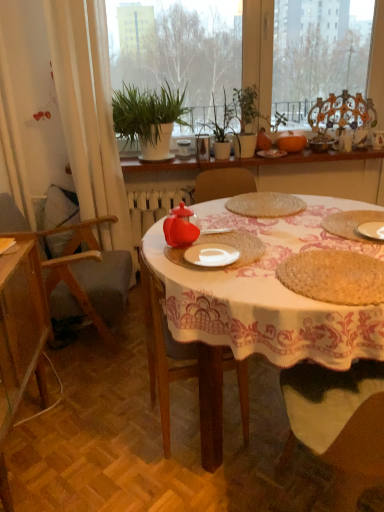
Question: Is the position of transparent glass chair at upper right, the 1th chair positioned from the right, more distant than that of green matte plant at center?

Choices:
 (A) no
 (B) yes

Answer: (B)

Question: Considering the relative sizes of transparent glass chair at upper right, which is the 3th chair from front to back, and green matte plant at center in the image provided, is transparent glass chair at upper right, which is the 3th chair from front to back, thinner than green matte plant at center?

Choices:
 (A) yes
 (B) no

Answer: (A)

Question: Can you confirm if transparent glass chair at upper right, the first chair in the back-to-front sequence, is taller than green matte plant at center?

Choices:
 (A) yes
 (B) no

Answer: (B)

Question: Is transparent glass chair at upper right, which is the 3th chair from front to back, touching green matte plant at center?

Choices:
 (A) yes
 (B) no

Answer: (B)

Question: Can you confirm if transparent glass chair at upper right, the first chair in the back-to-front sequence, is smaller than green matte plant at center?

Choices:
 (A) yes
 (B) no

Answer: (A)

Question: In the image, is wooden chair at left, which ranks as the second chair in top-to-bottom order, positioned in front of or behind orange matte pumpkin at center?

Choices:
 (A) front
 (B) behind

Answer: (A)

Question: From their relative heights in the image, would you say wooden chair at left, which ranks as the second chair in top-to-bottom order, is taller or shorter than orange matte pumpkin at center?

Choices:
 (A) tall
 (B) short

Answer: (A)

Question: Considering the positions of wooden chair at left, which is the first chair from left to right, and orange matte pumpkin at center in the image, is wooden chair at left, which is the first chair from left to right, bigger or smaller than orange matte pumpkin at center?

Choices:
 (A) big
 (B) small

Answer: (A)

Question: From a real-world perspective, is wooden chair at left, which is the first chair from left to right, physically located above or below orange matte pumpkin at center?

Choices:
 (A) above
 (B) below

Answer: (B)

Question: In terms of width, does matte glass teapot at center look wider or thinner when compared to wooden shelf at center?

Choices:
 (A) wide
 (B) thin

Answer: (B)

Question: From a real-world perspective, is matte glass teapot at center physically located above or below wooden shelf at center?

Choices:
 (A) below
 (B) above

Answer: (B)

Question: Is matte glass teapot at center in front of or behind wooden shelf at center in the image?

Choices:
 (A) front
 (B) behind

Answer: (A)

Question: Would you say matte glass teapot at center is inside or outside wooden shelf at center?

Choices:
 (A) outside
 (B) inside

Answer: (A)

Question: From a real-world perspective, is matte ceramic bowl at upper right, which is counted as the 2th tableware, starting from the left, above or below green matte plant at center?

Choices:
 (A) above
 (B) below

Answer: (B)

Question: Is matte ceramic bowl at upper right, the 1th tableware viewed from the right, bigger or smaller than green matte plant at center?

Choices:
 (A) big
 (B) small

Answer: (B)